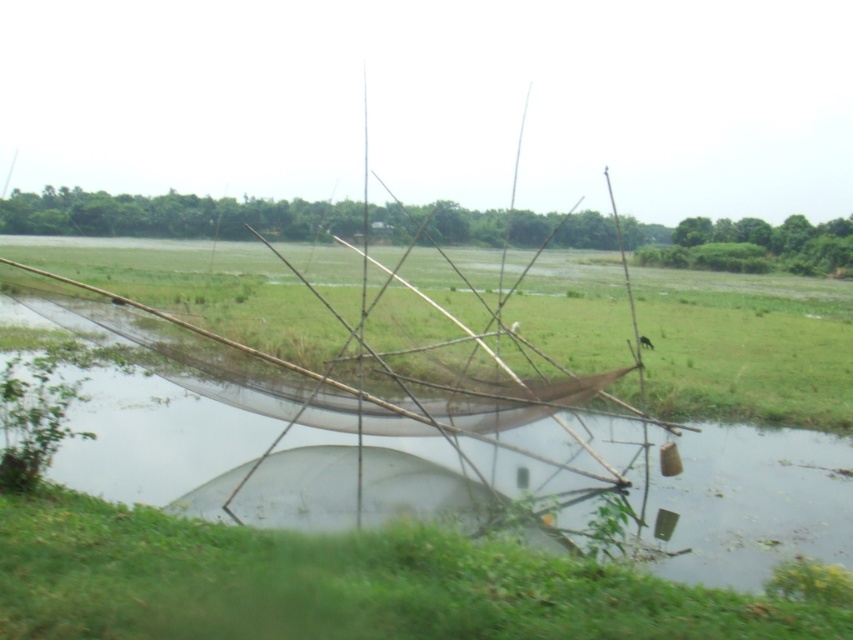
You are a hiker trying to cross the area where the green grass at lower left and the green grass at center are located. Which area would be easier to walk through based on the grass height?

The green grass at lower left is shorter than the green grass at center, so it would be easier to walk through the area with the green grass at lower left.

You are standing in the rural scene and want to walk from the green grass at lower left to the green grass at center. Which direction should you move to reach your destination?

To move from the green grass at lower left to the green grass at center, you should move to the right since the green grass at lower left is positioned on the right side of green grass at center.

You are standing at the edge of the water and see the green grass at lower left and the green grass at center. Which one is closer to you?

The green grass at lower left is closer to you because it is in front of the green grass at center.